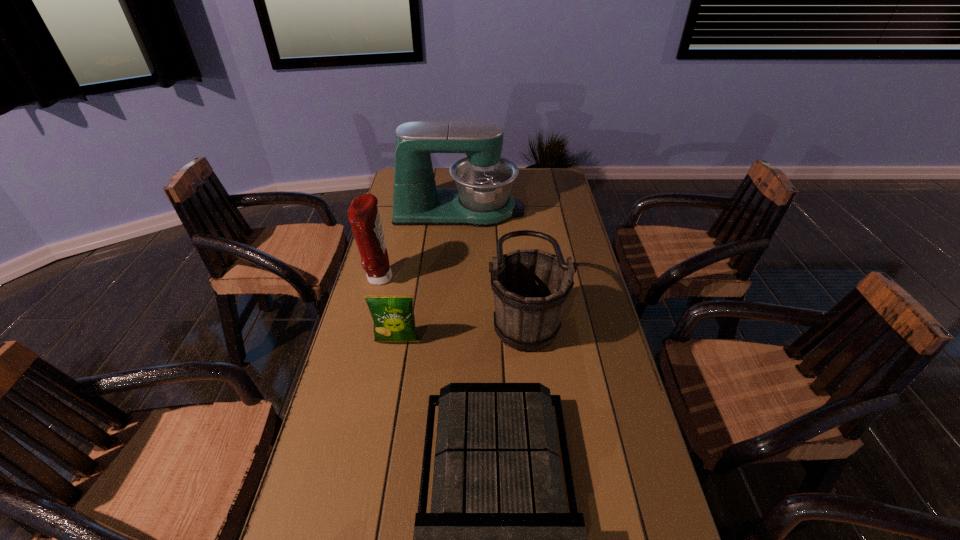
Image resolution: width=960 pixels, height=540 pixels. I want to click on mixer, so click(x=482, y=198).

Find the location of a particular element. This screenshot has height=540, width=960. condiment is located at coordinates (363, 214).

Where is `the third shortest object`? the third shortest object is located at coordinates (531, 286).

Locate an element on the screen. The image size is (960, 540). the second shortest object is located at coordinates (393, 315).

Where is `vacant space located on the front-facing side of the mixer`? The width and height of the screenshot is (960, 540). vacant space located on the front-facing side of the mixer is located at coordinates (564, 210).

Locate an element on the screen. vacant space located 0.080m on the front of the fourth shortest object is located at coordinates (371, 309).

The image size is (960, 540). In order to click on vacant space situated on the handle side of the third tallest object in this screenshot , I will do `click(441, 315)`.

The height and width of the screenshot is (540, 960). In order to click on vacant space situated on the handle side of the third tallest object in this screenshot , I will do `click(397, 315)`.

The width and height of the screenshot is (960, 540). I want to click on free space located on the handle side of the third tallest object, so click(374, 315).

The image size is (960, 540). In order to click on vacant space located 0.340m on the front-facing side of the fourth tallest object in this screenshot , I will do `click(373, 468)`.